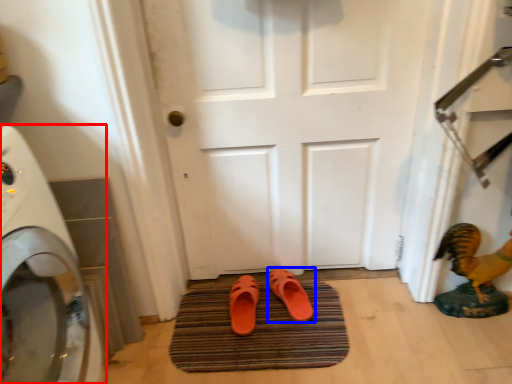
Question: Which of the following is the farthest to the observer, home appliance (highlighted by a red box) or footwear (highlighted by a blue box)?

Choices:
 (A) home appliance
 (B) footwear

Answer: (B)